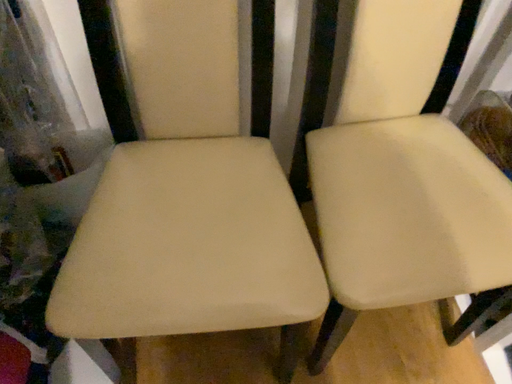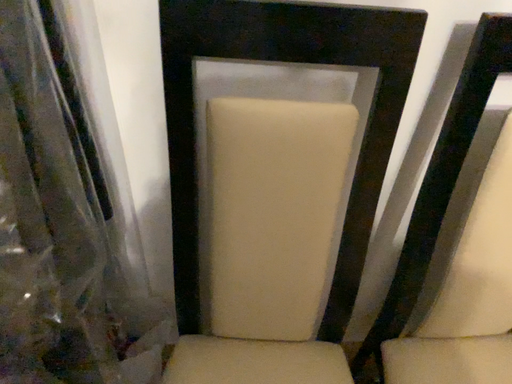
Question: How did the camera likely rotate when shooting the video?

Choices:
 (A) rotated downward
 (B) rotated upward

Answer: (B)